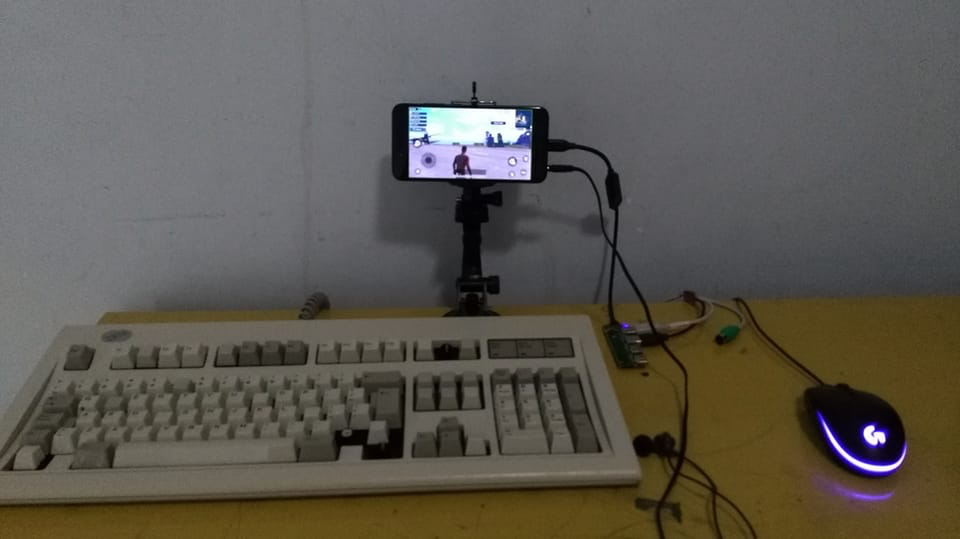
What are the coordinates of `phone` in the screenshot? It's located at (395, 141).